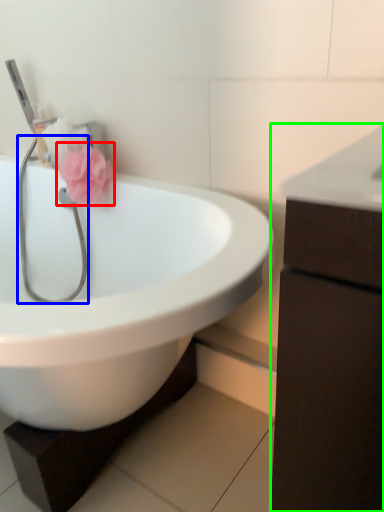
Question: Based on their relative distances, which object is farther from flower (highlighted by a red box)? Choose from stethoscope (highlighted by a blue box) and bathroom cabinet (highlighted by a green box).

Choices:
 (A) stethoscope
 (B) bathroom cabinet

Answer: (B)